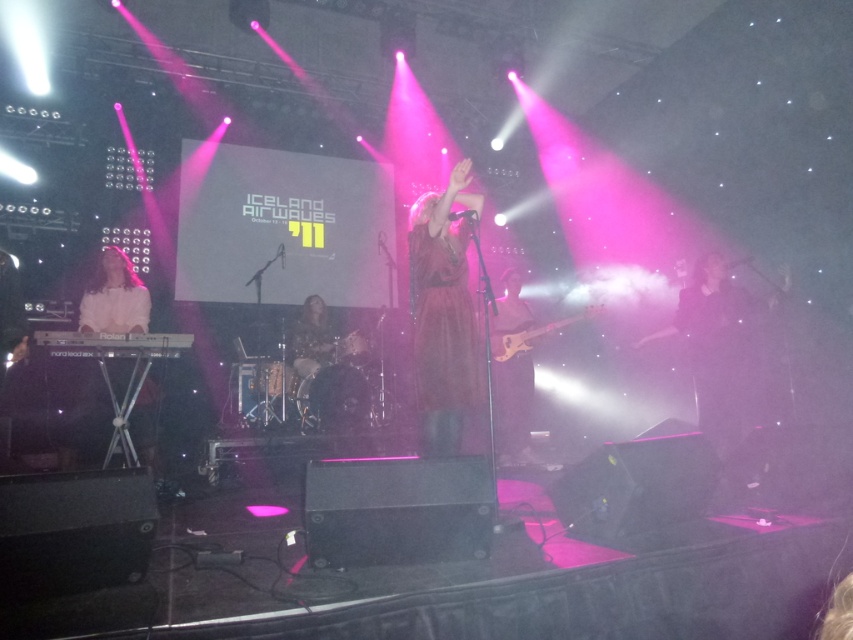
You are a photographer at the Iceland Airwaves festival in 2011. You need to capture a photo where both the matte pink dress at center and the white matte keyboard at left are clearly visible. Given their heights, which object should you focus on first to ensure both are in focus?

The matte pink dress at center is taller than the white matte keyboard at left. To ensure both are in focus, you should focus on the taller object first, which is the matte pink dress at center, as focusing on the taller object helps in capturing the depth required for both subjects.

You are a photographer trying to capture the performer in the center of the stage. There is a point at coordinates [729,364] on the black fabric at center. Where should you focus your camera to ensure the performer is centered?

The point at coordinates [729,364] is on the black fabric at center, so focusing there will center the performer.

You are a stagehand at the Iceland Airwaves festival in 2011. You need to place a microphone stand exactly halfway between the white matte keyboard at left and the edge of the stage. What coordinate should you aim for if the stage edge is at point 0.0?

The white matte keyboard at left is at point 0.466, so halfway between 0.466 and 0.0 would be 0.233. Place the microphone stand at coordinate 0.233.